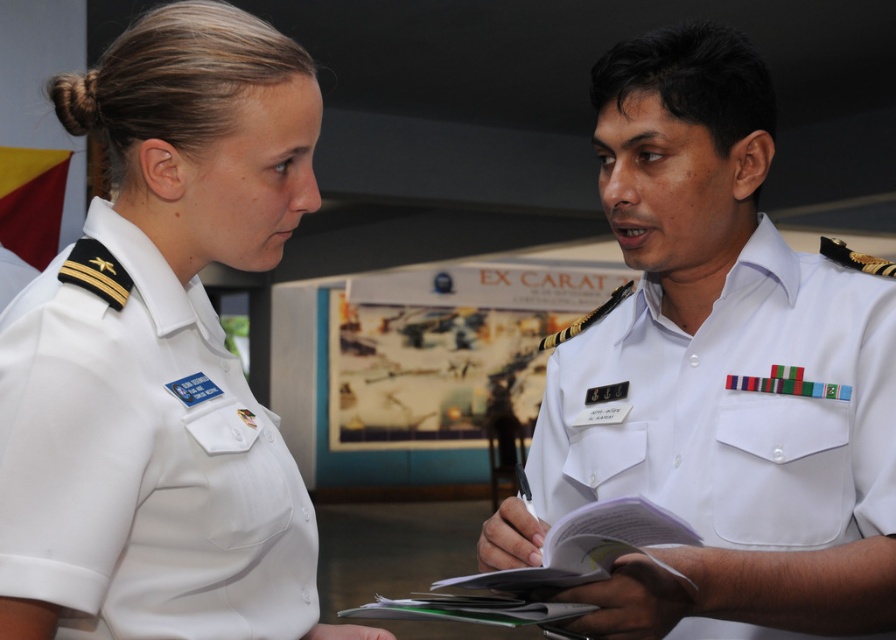
Measure the distance between point (645, 609) and camera.

The distance of point (645, 609) from camera is 1.10 meters.

Does white uniform at right have a larger size compared to white cotton shirt at upper left?

Indeed, white uniform at right has a larger size compared to white cotton shirt at upper left.

Locate an element on the screen. The width and height of the screenshot is (896, 640). white uniform at right is located at coordinates (721, 371).